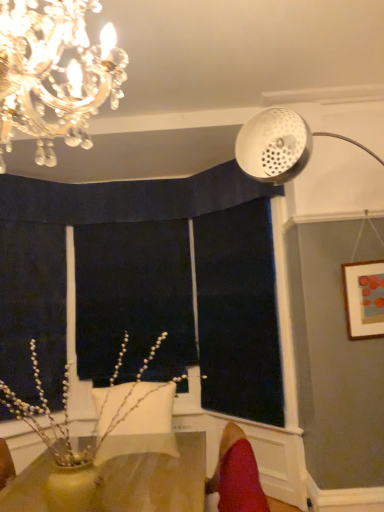
Question: Could you tell me if black fabric at center, marked as the first window screen in a left-to-right arrangement, is turned towards white pearlized branches at lower left?

Choices:
 (A) no
 (B) yes

Answer: (B)

Question: Is black fabric at center, the second window screen in the right-to-left sequence, closer to camera compared to white pearlized branches at lower left?

Choices:
 (A) no
 (B) yes

Answer: (A)

Question: Is black fabric at center, marked as the first window screen in a left-to-right arrangement, at the left side of white pearlized branches at lower left?

Choices:
 (A) yes
 (B) no

Answer: (A)

Question: Considering the relative sizes of black fabric at center, the second window screen in the right-to-left sequence, and white pearlized branches at lower left in the image provided, is black fabric at center, the second window screen in the right-to-left sequence, wider than white pearlized branches at lower left?

Choices:
 (A) no
 (B) yes

Answer: (A)

Question: Can you confirm if black fabric at center, marked as the first window screen in a left-to-right arrangement, is bigger than white pearlized branches at lower left?

Choices:
 (A) no
 (B) yes

Answer: (A)

Question: Is black fabric at center, the second window screen in the right-to-left sequence, not inside white pearlized branches at lower left?

Choices:
 (A) no
 (B) yes

Answer: (B)

Question: Can you confirm if red velvet swivel chair at lower right is wider than crystal chandelier at upper left?

Choices:
 (A) yes
 (B) no

Answer: (B)

Question: From the image's perspective, is red velvet swivel chair at lower right over crystal chandelier at upper left?

Choices:
 (A) yes
 (B) no

Answer: (B)

Question: Is red velvet swivel chair at lower right bigger than crystal chandelier at upper left?

Choices:
 (A) no
 (B) yes

Answer: (A)

Question: Does red velvet swivel chair at lower right turn towards crystal chandelier at upper left?

Choices:
 (A) no
 (B) yes

Answer: (A)

Question: Is red velvet swivel chair at lower right turned away from crystal chandelier at upper left?

Choices:
 (A) yes
 (B) no

Answer: (B)

Question: Is red velvet swivel chair at lower right closer to camera compared to crystal chandelier at upper left?

Choices:
 (A) yes
 (B) no

Answer: (B)

Question: Is dark blue fabric at center, which ranks as the first window screen in right-to-left order, inside black fabric at center, marked as the first window screen in a left-to-right arrangement?

Choices:
 (A) no
 (B) yes

Answer: (A)